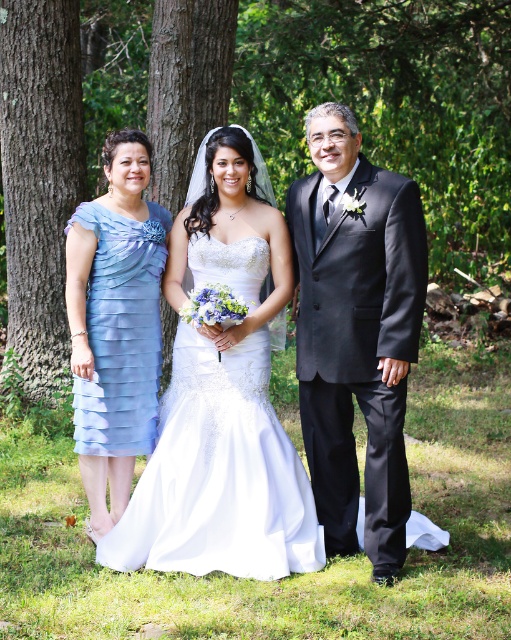
Which is more to the left, white satin dress at center or light blue chiffon dress at left?

Positioned to the left is light blue chiffon dress at left.

Is white satin dress at center closer to camera compared to light blue chiffon dress at left?

Yes, it is.

Is point (223, 353) positioned in front of point (110, 509)?

Yes, point (223, 353) is in front of point (110, 509).

Where is `white satin dress at center`? The height and width of the screenshot is (640, 511). white satin dress at center is located at coordinates (219, 474).

Does green textured tree at center have a larger size compared to brown rough tree trunk at left?

Incorrect, green textured tree at center is not larger than brown rough tree trunk at left.

Is green textured tree at center taller than brown rough tree trunk at left?

No.

Identify the location of green textured tree at center. Image resolution: width=511 pixels, height=640 pixels. click(x=392, y=104).

Who is lower down, black satin suit at right or brown rough tree trunk at left?

black satin suit at right is below.

Between black satin suit at right and brown rough tree trunk at left, which one has more height?

Standing taller between the two is brown rough tree trunk at left.

Who is more distant from viewer, (385, 349) or (7, 285)?

Positioned behind is point (7, 285).

In order to click on black satin suit at right in this screenshot , I will do `click(356, 332)`.